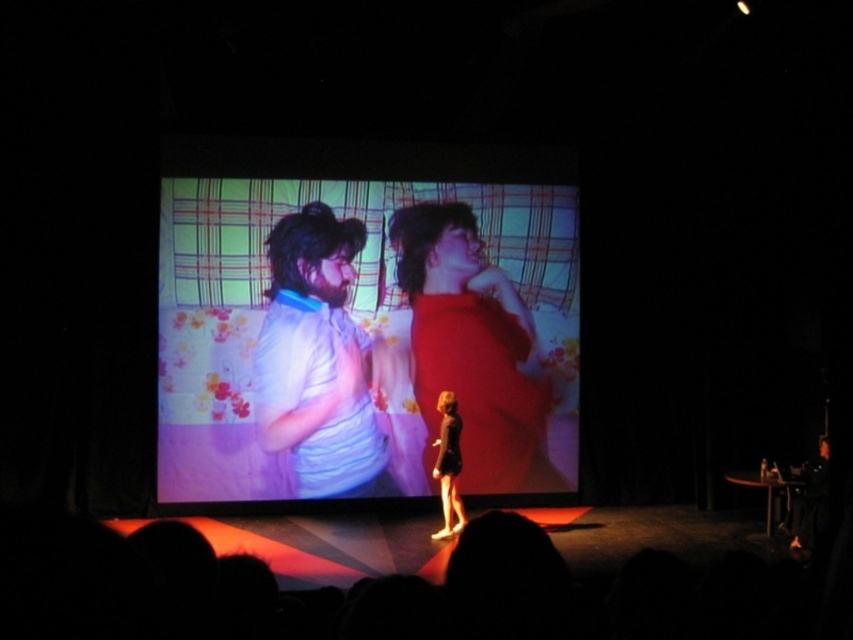
Does light blue fabric shirt at center have a larger size compared to black satin dress at center?

Yes.

Is point (316, 378) more distant than point (448, 506)?

Yes, point (316, 378) is farther from viewer.

Identify the location of light blue fabric shirt at center. This screenshot has width=853, height=640. (318, 362).

Which is in front, point (529, 492) or point (358, 422)?

Point (358, 422) is in front.

Is matte red dress at center above light blue fabric shirt at center?

Actually, matte red dress at center is below light blue fabric shirt at center.

Between point (546, 452) and point (374, 474), which one is positioned in front?

Point (374, 474) is more forward.

Locate an element on the screen. The height and width of the screenshot is (640, 853). matte red dress at center is located at coordinates (473, 349).

Between matte red dress at center and black satin dress at center, which one has less height?

black satin dress at center is shorter.

Describe the element at coordinates (473, 349) in the screenshot. The width and height of the screenshot is (853, 640). I see `matte red dress at center` at that location.

Where is `matte red dress at center`? matte red dress at center is located at coordinates (473, 349).